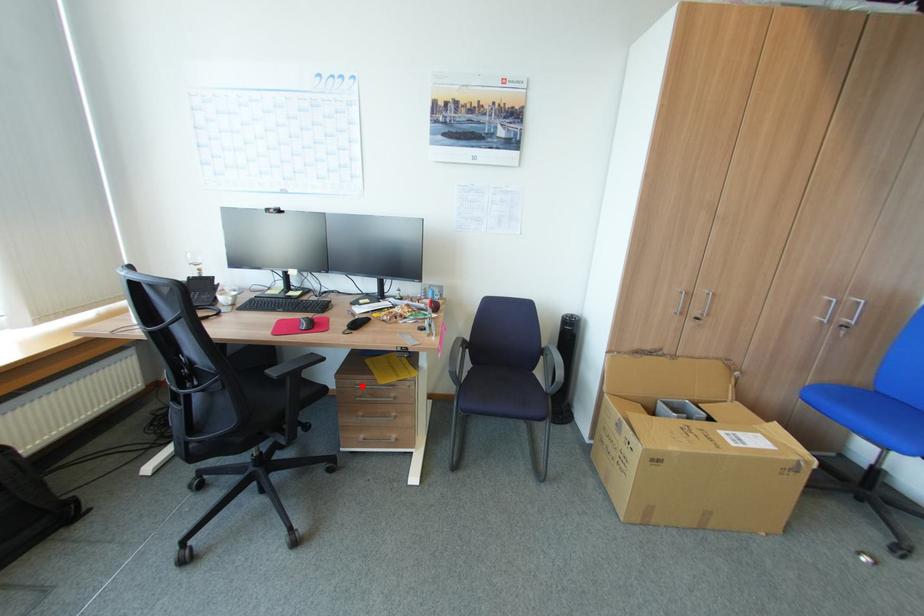
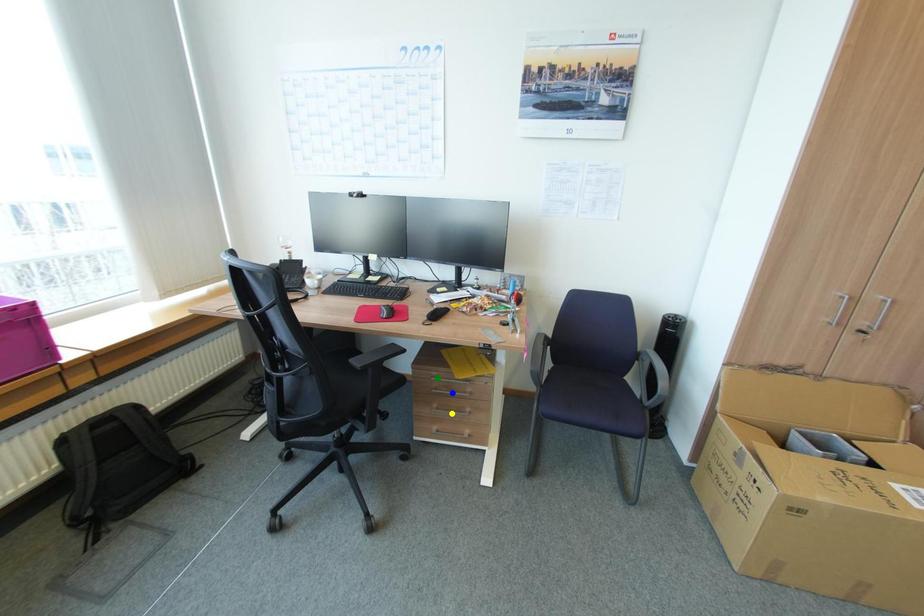
Question: I am providing you with two images of the same scene from different viewpoints. A red point is marked on the first image. You are given multiple points on the second image. Which point in image 2 is actually the same real-world point as the red point in image 1?

Choices:
 (A) blue point
 (B) yellow point
 (C) green point

Answer: (C)